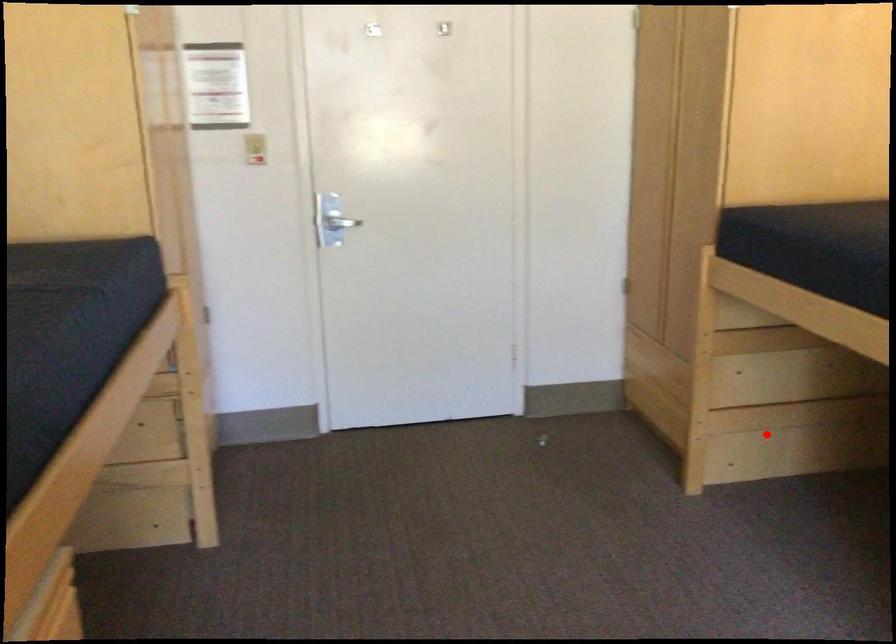
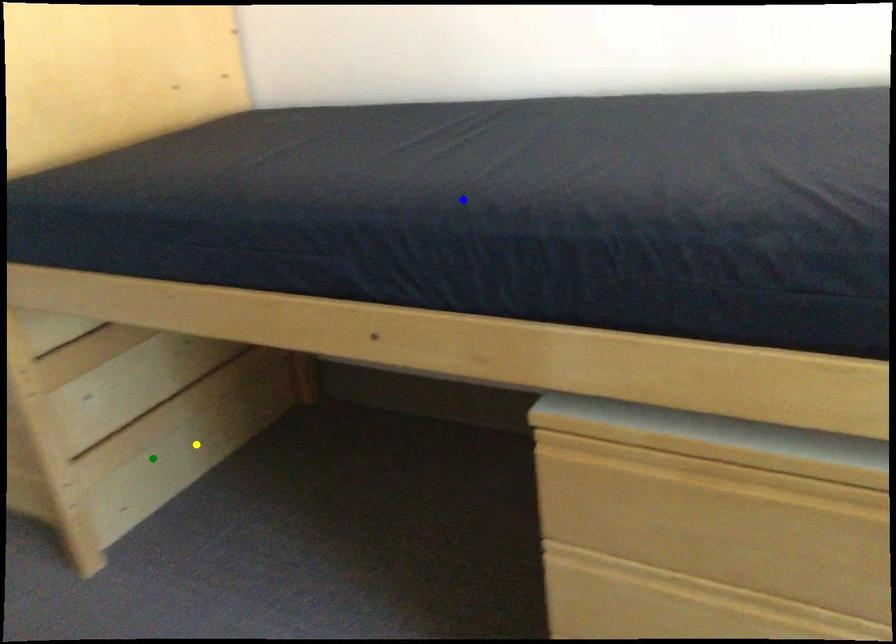
Question: I am providing you with two images of the same scene from different viewpoints. A red point is marked on the first image. You are given multiple points on the second image. Which spot in image 2 lines up with the point in image 1?

Choices:
 (A) green point
 (B) blue point
 (C) yellow point

Answer: (A)